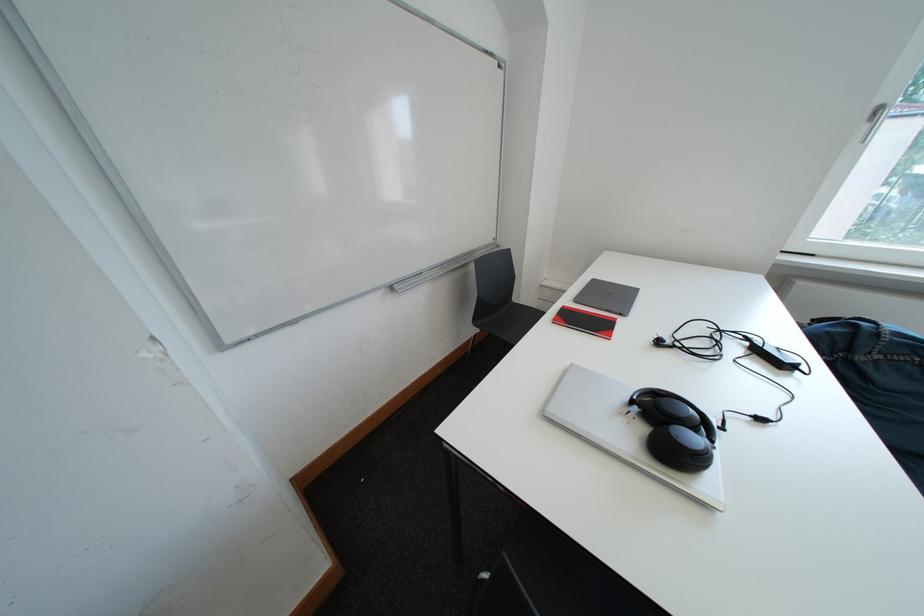
The image size is (924, 616). I want to click on whiteboard marker rail, so click(442, 268).